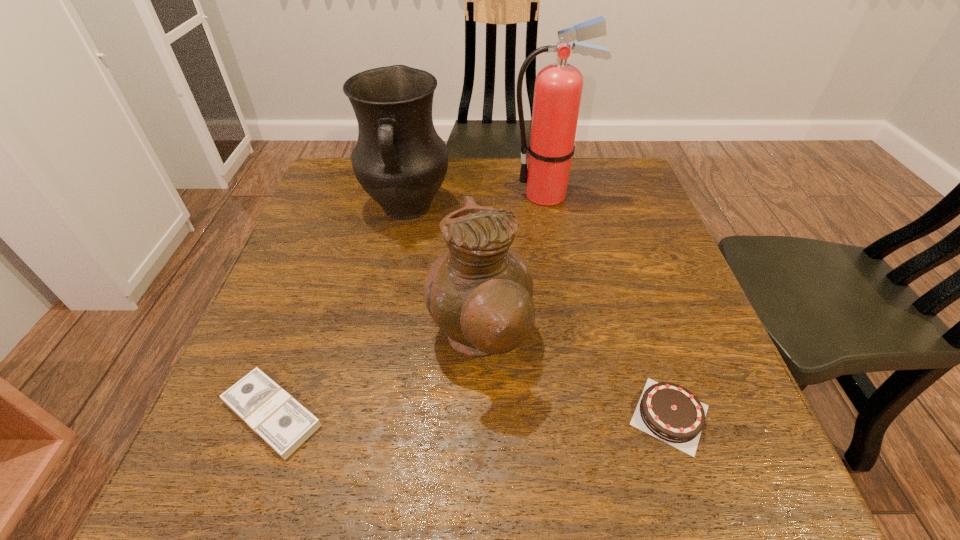
I want to click on fire extinguisher, so click(558, 89).

Image resolution: width=960 pixels, height=540 pixels. I want to click on the farther pitcher, so click(399, 159).

This screenshot has height=540, width=960. Identify the location of the nearer pitcher. (479, 292).

You are a GUI agent. You are given a task and a screenshot of the screen. Output one action in this format:
    pyautogui.click(x=<x>, y=<y>)
    Task: Click on the fourth tallest object
    The image size is (960, 540).
    Given the screenshot: What is the action you would take?
    pyautogui.click(x=667, y=411)

At what (x,y) coordinates should I click in order to perform the action: click on dollar. Please return your answer as a coordinate pair (x, y). The width and height of the screenshot is (960, 540). Looking at the image, I should click on (283, 423).

Locate an element on the screen. The image size is (960, 540). blank space located on the hose direction of the fire extinguisher is located at coordinates (421, 195).

Where is `vacant area located on the hose direction of the fire extinguisher`? The height and width of the screenshot is (540, 960). vacant area located on the hose direction of the fire extinguisher is located at coordinates (403, 195).

Find the location of a particular element. vacant space located 0.240m on the hose direction of the fire extinguisher is located at coordinates [421, 195].

Locate an element on the screen. The width and height of the screenshot is (960, 540). vacant region located 0.270m on the handle side of the farther pitcher is located at coordinates (383, 326).

Image resolution: width=960 pixels, height=540 pixels. Identify the location of vacant space located 0.120m at the spout of the nearer pitcher. (591, 339).